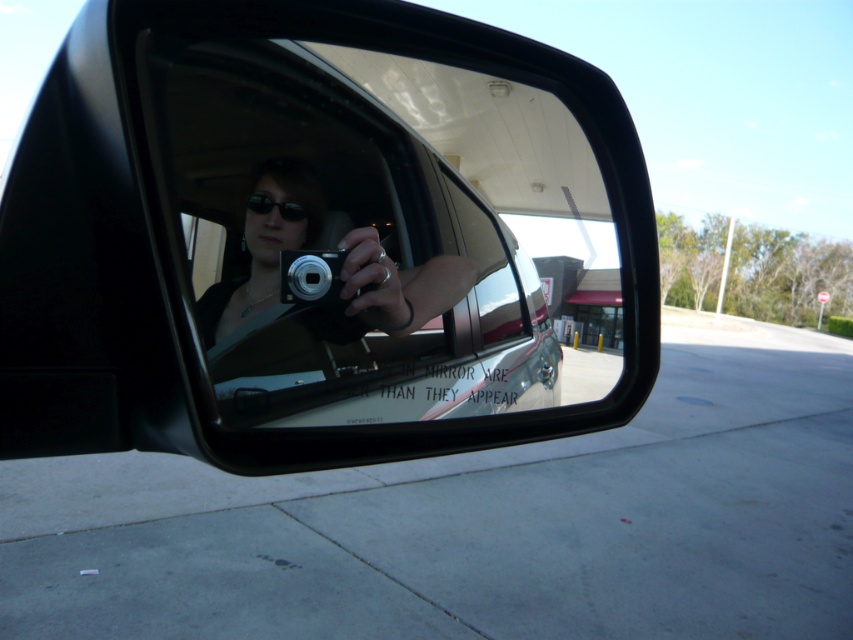
Question: Which of these objects is positioned farthest from the transparent glass car window at center?

Choices:
 (A) silver metallic camera at center
 (B) matte black camera at center

Answer: (A)

Question: Is transparent glass car window at center to the right of silver metallic camera at center from the viewer's perspective?

Choices:
 (A) no
 (B) yes

Answer: (B)

Question: Which of the following is the farthest from the observer?

Choices:
 (A) transparent glass car window at center
 (B) silver metallic camera at center
 (C) matte black camera at center

Answer: (B)

Question: Can you confirm if matte black camera at center is bigger than silver metallic camera at center?

Choices:
 (A) no
 (B) yes

Answer: (B)

Question: Is transparent glass car window at center thinner than silver metallic camera at center?

Choices:
 (A) no
 (B) yes

Answer: (A)

Question: Which is farther from the matte black camera at center?

Choices:
 (A) silver metallic camera at center
 (B) transparent glass car window at center

Answer: (A)